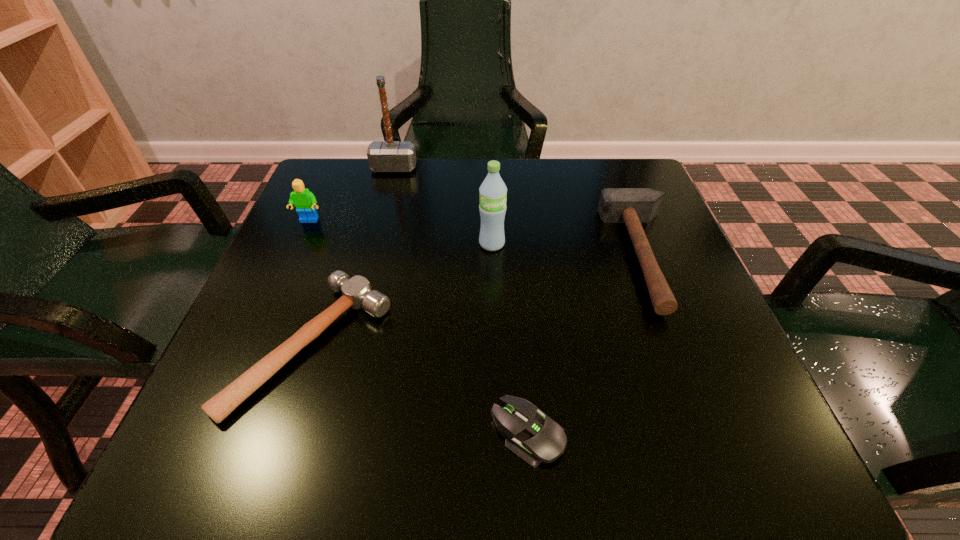
Select which object appears as the closest to the third tallest object. Please provide its 2D coordinates. Your answer should be formatted as a tuple, i.e. [(x, y)], where the tuple contains the x and y coordinates of a point satisfying the conditions above.

[(357, 293)]

Identify which hammer is the third nearest to the third tallest object. Please provide its 2D coordinates. Your answer should be formatted as a tuple, i.e. [(x, y)], where the tuple contains the x and y coordinates of a point satisfying the conditions above.

[(632, 206)]

I want to click on the third closest hammer to the Lego, so click(x=632, y=206).

Find the location of a particular element. vacant area in the image that satisfies the following two spatial constraints: 1. on the face of the shortest hammer; 2. on the left side of the Lego is located at coordinates (254, 345).

The image size is (960, 540). What are the coordinates of `free spot that satisfies the following two spatial constraints: 1. on the face of the fourth shortest object; 2. on the right side of the second shortest object` in the screenshot? It's located at (254, 345).

Image resolution: width=960 pixels, height=540 pixels. What are the coordinates of `vacant area that satisfies the following two spatial constraints: 1. on the face of the fourth shortest object; 2. on the left side of the computer mouse` in the screenshot? It's located at 215,433.

Image resolution: width=960 pixels, height=540 pixels. In order to click on vacant space that satisfies the following two spatial constraints: 1. on the face of the water bottle; 2. on the right side of the Lego in this screenshot , I will do `click(299, 244)`.